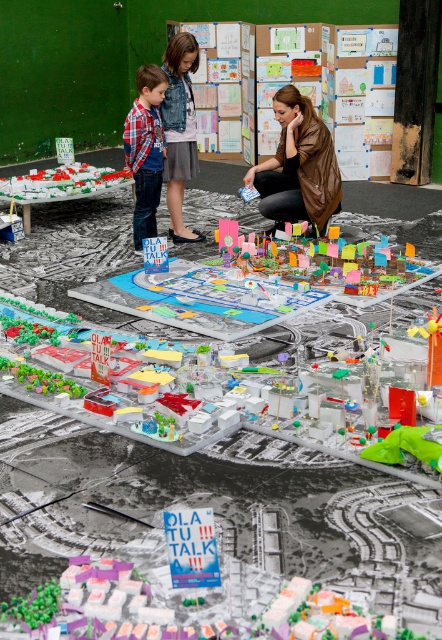
Question: Among these objects, which one is nearest to the camera?

Choices:
 (A) plaid shirt at center
 (B) brown leather jacket at upper center
 (C) brown leather jacket at center

Answer: (A)

Question: Can you confirm if plaid shirt at center is positioned to the left of colorful plastic cityscape at center?

Choices:
 (A) no
 (B) yes

Answer: (B)

Question: Can you confirm if brown leather jacket at center is positioned to the left of colorful plastic cityscape at center?

Choices:
 (A) yes
 (B) no

Answer: (A)

Question: Estimate the real-world distances between objects in this image. Which object is closer to the plaid shirt at center?

Choices:
 (A) colorful plastic cityscape at center
 (B) brown leather jacket at upper center
 (C) brown leather jacket at center

Answer: (B)

Question: Can you confirm if plaid shirt at center is wider than colorful plastic cityscape at center?

Choices:
 (A) no
 (B) yes

Answer: (A)

Question: Among these objects, which one is farthest from the camera?

Choices:
 (A) brown leather jacket at upper center
 (B) colorful plastic cityscape at center
 (C) brown leather jacket at center
 (D) plaid shirt at center

Answer: (C)